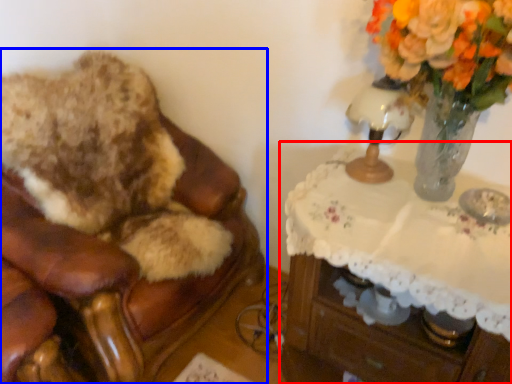
Question: Which of the following is the closest to the observer, table (highlighted by a red box) or furniture (highlighted by a blue box)?

Choices:
 (A) table
 (B) furniture

Answer: (A)